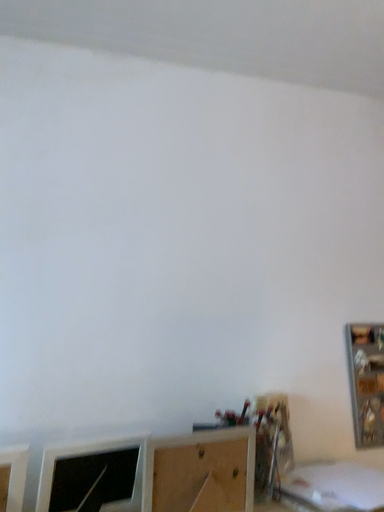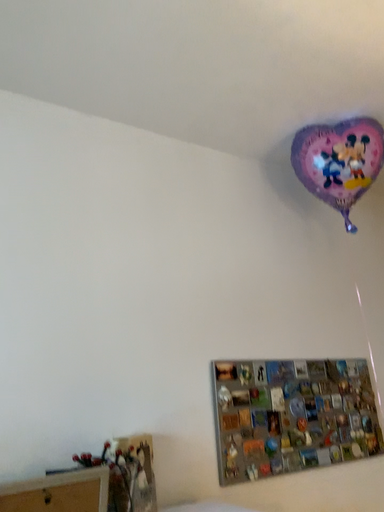
Question: Which way did the camera rotate in the video?

Choices:
 (A) rotated upward
 (B) rotated downward

Answer: (A)